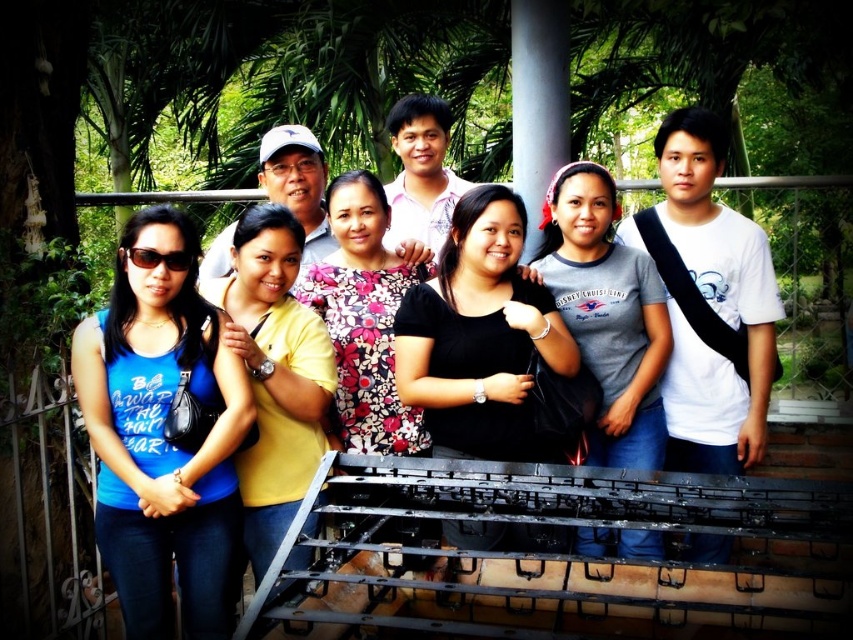
You are taking a photo of the group on the balcony. You want to focus on the person at point (506, 310) and the person at point (259, 324). Which of these two points is closer to the camera?

Point (506, 310) is closer to the camera than point (259, 324).

You are a photographer trying to adjust the composition of the group photo. You notice two people wearing shirts of different colors at the center. Which shirt has a wider silhouette between the black matte shirt at center and the yellow matte shirt at center?

The black matte shirt at center has a wider silhouette than the yellow matte shirt at center, as its width surpasses the latter according to the description.